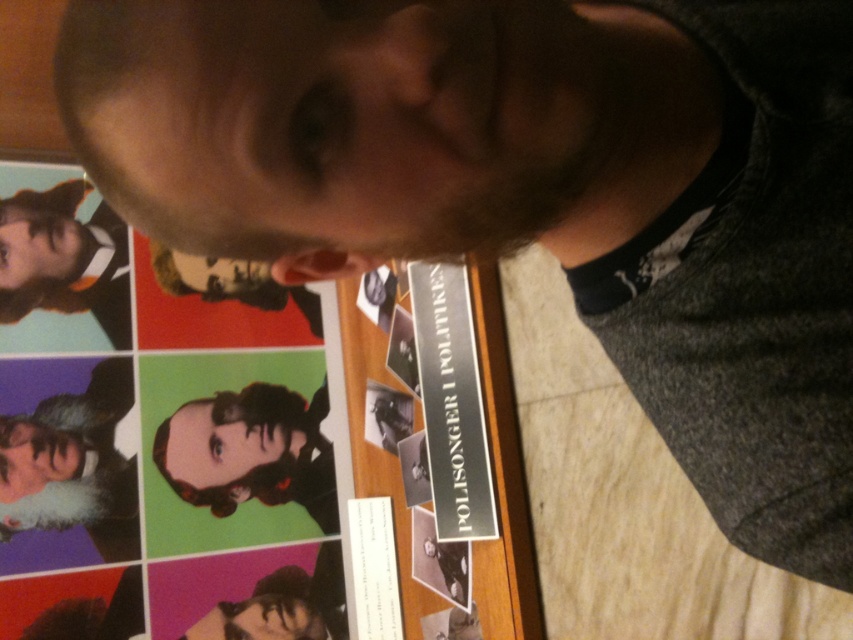
Question: Can you confirm if white beard at lower left is bigger than matte black beard at upper left?

Choices:
 (A) no
 (B) yes

Answer: (B)

Question: Can you confirm if white beard at lower left is thinner than matte black beard at upper left?

Choices:
 (A) yes
 (B) no

Answer: (A)

Question: Which of the following is the farthest from the observer?

Choices:
 (A) (68, 492)
 (B) (53, 244)

Answer: (B)

Question: Which object is positioned farthest from the shiny black hair at center?

Choices:
 (A) white beard at lower left
 (B) matte black beard at upper left
 (C) smooth black hair at lower center

Answer: (B)

Question: Does shiny black hair at center have a larger size compared to smooth black hair at lower center?

Choices:
 (A) yes
 (B) no

Answer: (A)

Question: Which of the following is the farthest from the observer?

Choices:
 (A) shiny black hair at center
 (B) smooth black hair at lower center

Answer: (A)